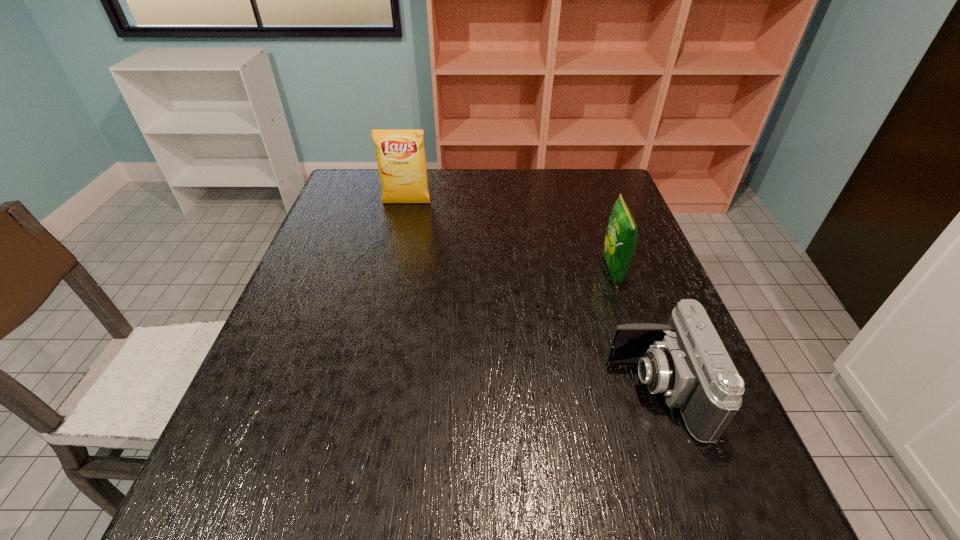
This screenshot has width=960, height=540. In the image, there is a desktop. Find the location of `vacant region at the right edge`. vacant region at the right edge is located at coordinates (642, 323).

In the image, there is a desktop. Identify the location of free space at the far left corner. The image size is (960, 540). (376, 195).

Locate an element on the screen. This screenshot has width=960, height=540. free space at the far right corner is located at coordinates (623, 193).

Locate an element on the screen. This screenshot has width=960, height=540. empty space between the second shortest object and the left crisp (potato chip) is located at coordinates (510, 238).

Identify the location of free space between the taller crisp (potato chip) and the second farthest object. (510, 238).

Find the location of a particular element. This screenshot has height=540, width=960. free spot between the camera and the leftmost object is located at coordinates (531, 296).

Locate an element on the screen. The image size is (960, 540). free space between the leftmost object and the shorter crisp (potato chip) is located at coordinates (510, 238).

The image size is (960, 540). Identify the location of free spot between the second shortest object and the taller crisp (potato chip). click(510, 238).

The image size is (960, 540). I want to click on the second closest object to the shortest object, so click(400, 153).

Locate an element on the screen. This screenshot has height=540, width=960. object that ranks as the closest to the second tallest object is located at coordinates 685,360.